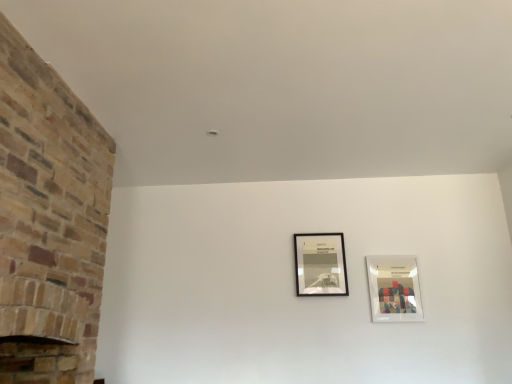
Question: Considering the relative positions of brick fireplace at left and white glossy picture frame at upper right, the second picture frame positioned from the left, in the image provided, is brick fireplace at left to the left or to the right of white glossy picture frame at upper right, the second picture frame positioned from the left,?

Choices:
 (A) right
 (B) left

Answer: (B)

Question: Does point (36, 183) appear closer or farther from the camera than point (394, 309)?

Choices:
 (A) farther
 (B) closer

Answer: (B)

Question: Based on their relative distances, which object is farther from the brick fireplace at left?

Choices:
 (A) black matte picture frame at center, the 1th picture frame viewed from the left
 (B) white glossy picture frame at upper right, the second picture frame positioned from the left

Answer: (B)

Question: Which is farther from the black matte picture frame at center, the 1th picture frame viewed from the left?

Choices:
 (A) white glossy picture frame at upper right, marked as the first picture frame in a right-to-left arrangement
 (B) brick fireplace at left

Answer: (B)